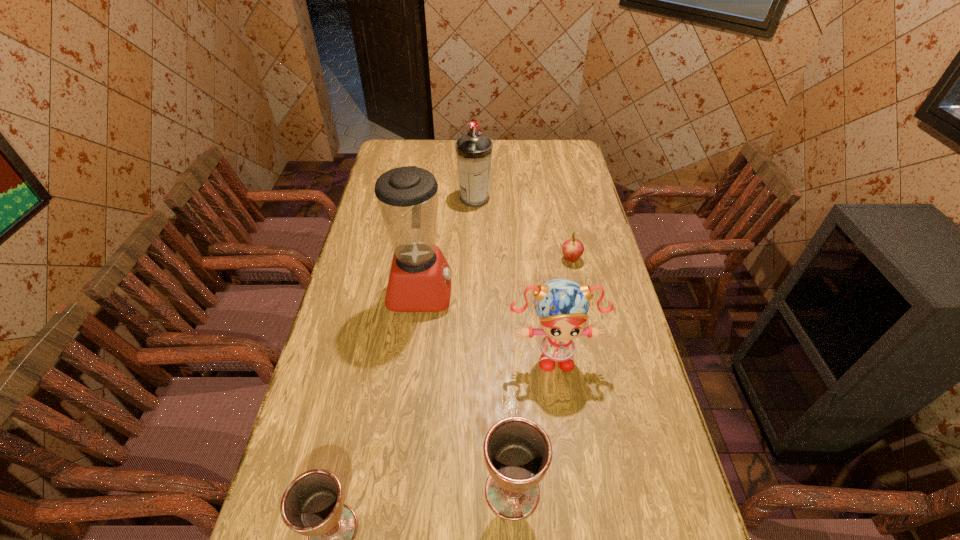
In the image, there is a desktop. Identify the location of vacant space at the far left corner. (412, 140).

Where is `vacant space in between the apple and the tallest object`? Image resolution: width=960 pixels, height=540 pixels. vacant space in between the apple and the tallest object is located at coordinates (496, 275).

What are the coordinates of `free point between the right chalice and the apple` in the screenshot? It's located at (541, 375).

Find the location of `empty space that is in between the farthest object and the right chalice`. empty space that is in between the farthest object and the right chalice is located at coordinates (493, 345).

The image size is (960, 540). I want to click on free spot between the tallest object and the fourth shortest object, so click(x=487, y=322).

Where is `unoccupied position between the taller chalice and the aerosol can`? Image resolution: width=960 pixels, height=540 pixels. unoccupied position between the taller chalice and the aerosol can is located at coordinates (493, 345).

Where is `empty space between the blender and the shortest object`? This screenshot has height=540, width=960. empty space between the blender and the shortest object is located at coordinates (496, 275).

In order to click on free space between the third shortest object and the tallest object in this screenshot , I will do `click(467, 391)`.

Locate an element on the screen. This screenshot has height=540, width=960. object that stands as the second closest to the shorter chalice is located at coordinates (562, 304).

Select which object is the third closest to the right chalice. Please provide its 2D coordinates. Your answer should be formatted as a tuple, i.e. [(x, y)], where the tuple contains the x and y coordinates of a point satisfying the conditions above.

[(420, 277)]